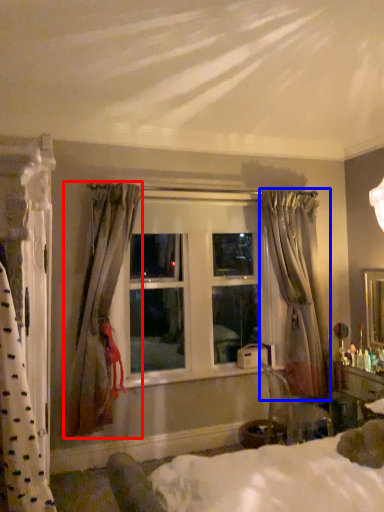
Question: Which point is further to the camera, curtain (highlighted by a red box) or curtain (highlighted by a blue box)?

Choices:
 (A) curtain
 (B) curtain

Answer: (B)